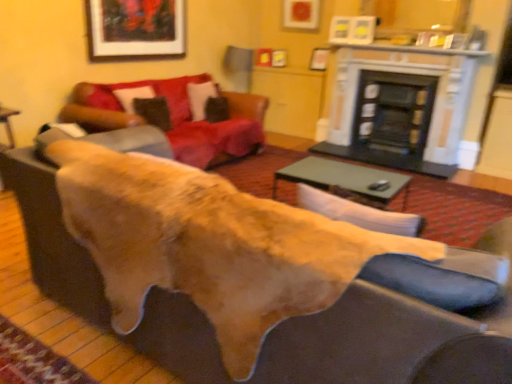
The image size is (512, 384). Find the location of `wooden mantelpiece at upper center`. wooden mantelpiece at upper center is located at coordinates (409, 49).

The height and width of the screenshot is (384, 512). Describe the element at coordinates (200, 98) in the screenshot. I see `velvet brown pillow at center, acting as the 2th pillow starting from the left` at that location.

What is the approximate width of velvet brown pillow at center, marked as the second pillow in a front-to-back arrangement?

It is 24.51 centimeters.

You are a GUI agent. You are given a task and a screenshot of the screen. Output one action in this format:
    pyautogui.click(x=<x>, y=<y>)
    Task: Click on the green glass table at center
    
    Given the screenshot: What is the action you would take?
    pyautogui.click(x=344, y=178)

This screenshot has height=384, width=512. Find the location of `velvet red couch at upper center`. velvet red couch at upper center is located at coordinates (175, 115).

What do you see at coordinates (392, 118) in the screenshot? I see `black glass fireplace at center, the 1th fireplace positioned from the right` at bounding box center [392, 118].

At what (x,y) coordinates should I click in order to perform the action: click on wooden mantelpiece at upper center. Please return your answer as a coordinate pair (x, y). Looking at the image, I should click on (409, 49).

Does velvet brown pillow at center, the 1th pillow when ordered from right to left, touch brown suede pillow at upper left, positioned as the first pillow in left-to-right order?

No, velvet brown pillow at center, the 1th pillow when ordered from right to left, is not beside brown suede pillow at upper left, positioned as the first pillow in left-to-right order.

Which is behind, point (209, 86) or point (153, 124)?

The point (209, 86) is more distant.

Considering the sizes of objects velvet brown pillow at center, arranged as the first pillow when viewed from the back, and brown suede pillow at upper left, positioned as the first pillow in left-to-right order, in the image provided, who is smaller, velvet brown pillow at center, arranged as the first pillow when viewed from the back, or brown suede pillow at upper left, positioned as the first pillow in left-to-right order,?

brown suede pillow at upper left, positioned as the first pillow in left-to-right order.

Which is in front, point (139, 11) or point (410, 97)?

Positioned in front is point (139, 11).

Does wooden framed artwork at upper center have a greater height compared to black glass fireplace at center, the 1th fireplace positioned from the right?

No, wooden framed artwork at upper center is not taller than black glass fireplace at center, the 1th fireplace positioned from the right.

In terms of size, does wooden framed artwork at upper center appear bigger or smaller than black glass fireplace at center, the 1th fireplace positioned from the right?

Considering their sizes, wooden framed artwork at upper center takes up less space than black glass fireplace at center, the 1th fireplace positioned from the right.

From a real-world perspective, between brown suede pillow at upper left, which is the 1th pillow from front to back, and black marble fireplace at upper center, acting as the 2th fireplace starting from the right, who is vertically lower?

brown suede pillow at upper left, which is the 1th pillow from front to back.

Does brown suede pillow at upper left, which is the 1th pillow from front to back, have a lesser width compared to black marble fireplace at upper center, acting as the 2th fireplace starting from the right?

No, brown suede pillow at upper left, which is the 1th pillow from front to back, is not thinner than black marble fireplace at upper center, acting as the 2th fireplace starting from the right.

Is brown suede pillow at upper left, the 2th pillow from the right, not near black marble fireplace at upper center, acting as the 2th fireplace starting from the right?

Yes, brown suede pillow at upper left, the 2th pillow from the right, and black marble fireplace at upper center, acting as the 2th fireplace starting from the right, are located far from each other.

Consider the image. From the image's perspective, who appears lower, brown suede pillow at upper left, positioned as the first pillow in left-to-right order, or black marble fireplace at upper center, the 1th fireplace in the left-to-right sequence?

brown suede pillow at upper left, positioned as the first pillow in left-to-right order, from the image's perspective.

Does point (458, 51) appear closer or farther from the camera than point (364, 101)?

Point (458, 51) appears to be closer to the viewer than point (364, 101).

Is wooden mantelpiece at upper center oriented towards black glass fireplace at center, which appears as the second fireplace when viewed from the left?

No, wooden mantelpiece at upper center is not turned towards black glass fireplace at center, which appears as the second fireplace when viewed from the left.

Would you say wooden mantelpiece at upper center is outside black glass fireplace at center, the 1th fireplace positioned from the right?

Yes, wooden mantelpiece at upper center is located beyond the bounds of black glass fireplace at center, the 1th fireplace positioned from the right.

In terms of height, does wooden mantelpiece at upper center look taller or shorter compared to black glass fireplace at center, which appears as the second fireplace when viewed from the left?

Considering their sizes, wooden mantelpiece at upper center has less height than black glass fireplace at center, which appears as the second fireplace when viewed from the left.

Is point (411, 52) closer to viewer compared to point (333, 161)?

No, it is not.

Locate an element on the screen. table in front of the wooden mantelpiece at upper center is located at coordinates 344,178.

Which is behind, wooden mantelpiece at upper center or green glass table at center?

wooden mantelpiece at upper center is further from the camera.

From a real-world perspective, is wooden mantelpiece at upper center located beneath green glass table at center?

No.

What's the angular difference between velvet red couch at upper center and wooden mantelpiece at upper center's facing directions?

The facing directions of velvet red couch at upper center and wooden mantelpiece at upper center are 90 degrees apart.

Could you tell me if velvet red couch at upper center is facing wooden mantelpiece at upper center?

No, velvet red couch at upper center is not aimed at wooden mantelpiece at upper center.

Is wooden mantelpiece at upper center surrounded by velvet red couch at upper center?

No, wooden mantelpiece at upper center is not surrounded by velvet red couch at upper center.

Are velvet red couch at upper center and wooden mantelpiece at upper center making contact?

velvet red couch at upper center is not next to wooden mantelpiece at upper center, and they're not touching.

Does wooden mantelpiece at upper center have a lesser width compared to black marble fireplace at upper center, acting as the 2th fireplace starting from the right?

No, wooden mantelpiece at upper center is not thinner than black marble fireplace at upper center, acting as the 2th fireplace starting from the right.

Which is behind, wooden mantelpiece at upper center or black marble fireplace at upper center, acting as the 2th fireplace starting from the right?

black marble fireplace at upper center, acting as the 2th fireplace starting from the right, is further from the camera.

Is there a large distance between wooden mantelpiece at upper center and black marble fireplace at upper center, acting as the 2th fireplace starting from the right?

Actually, wooden mantelpiece at upper center and black marble fireplace at upper center, acting as the 2th fireplace starting from the right, are a little close together.

How many degrees apart are the facing directions of wooden mantelpiece at upper center and black marble fireplace at upper center, acting as the 2th fireplace starting from the right?

The angular difference between wooden mantelpiece at upper center and black marble fireplace at upper center, acting as the 2th fireplace starting from the right, is 1.29 degrees.

There is a brown suede pillow at upper left, which is the 1th pillow from front to back. Identify the location of pillow above it (from a real-world perspective). This screenshot has height=384, width=512. (200, 98).

Locate an element on the screen. The image size is (512, 384). the 2nd fireplace directly beneath the wooden framed artwork at upper center (from a real-world perspective) is located at coordinates (392, 118).

From the image, which object appears to be nearer to velvet red couch at upper center, brown suede pillow at upper left, positioned as the first pillow in left-to-right order, or leather couch at center?

Based on the image, brown suede pillow at upper left, positioned as the first pillow in left-to-right order, appears to be nearer to velvet red couch at upper center.

Considering their positions, is velvet red couch at upper center positioned further to leather couch at center than black marble fireplace at upper center, the 1th fireplace in the left-to-right sequence?

The object further to leather couch at center is black marble fireplace at upper center, the 1th fireplace in the left-to-right sequence.

Looking at the image, which one is located closer to leather couch at center, velvet brown pillow at center, acting as the 2th pillow starting from the left, or green glass table at center?

green glass table at center.

From the image, which object appears to be nearer to wooden framed artwork at upper center, black marble fireplace at upper center, the 1th fireplace in the left-to-right sequence, or velvet brown pillow at center, acting as the 2th pillow starting from the left?

velvet brown pillow at center, acting as the 2th pillow starting from the left.

Consider the image. Based on their spatial positions, is green glass table at center or wooden mantelpiece at upper center further from wooden framed artwork at upper center?

green glass table at center lies further to wooden framed artwork at upper center than the other object.

From the image, which object appears to be nearer to green glass table at center, black glass fireplace at center, the 1th fireplace positioned from the right, or black marble fireplace at upper center, acting as the 2th fireplace starting from the right?

black glass fireplace at center, the 1th fireplace positioned from the right, lies closer to green glass table at center than the other object.

From the image, which object appears to be farther from black marble fireplace at upper center, the 1th fireplace in the left-to-right sequence, leather couch at center or brown suede pillow at upper left, the 2th pillow from the right?

leather couch at center.

Looking at this image, considering their positions, is black marble fireplace at upper center, acting as the 2th fireplace starting from the right, positioned closer to black glass fireplace at center, which appears as the second fireplace when viewed from the left, than leather couch at center?

black marble fireplace at upper center, acting as the 2th fireplace starting from the right, is positioned closer to the anchor black glass fireplace at center, which appears as the second fireplace when viewed from the left.

You are a GUI agent. You are given a task and a screenshot of the screen. Output one action in this format:
    pyautogui.click(x=<x>, y=<y>)
    Task: Click on the table positioned between leather couch at center and brown suede pillow at upper left, which is the 1th pillow from front to back, from near to far
    
    Given the screenshot: What is the action you would take?
    pyautogui.click(x=344, y=178)

At what (x,y) coordinates should I click in order to perform the action: click on fireplace between leather couch at center and velvet brown pillow at center, marked as the second pillow in a front-to-back arrangement, from front to back. Please return your answer as a coordinate pair (x, y). Looking at the image, I should click on (400, 107).

This screenshot has width=512, height=384. I want to click on table between velvet red couch at upper center and black glass fireplace at center, the 1th fireplace positioned from the right, in the horizontal direction, so click(x=344, y=178).

At what (x,y) coordinates should I click in order to perform the action: click on mantle located between velvet red couch at upper center and black marble fireplace at upper center, the 1th fireplace in the left-to-right sequence, in the left-right direction. Please return your answer as a coordinate pair (x, y). This screenshot has width=512, height=384. Looking at the image, I should click on (409, 49).